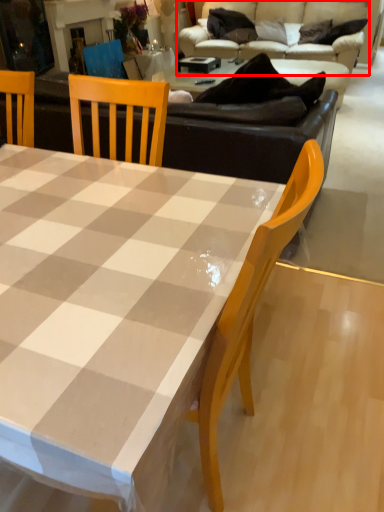
Question: Observing the image, what is the correct spatial positioning of studio couch (annotated by the red box) in reference to coffee table?

Choices:
 (A) left
 (B) right

Answer: (B)